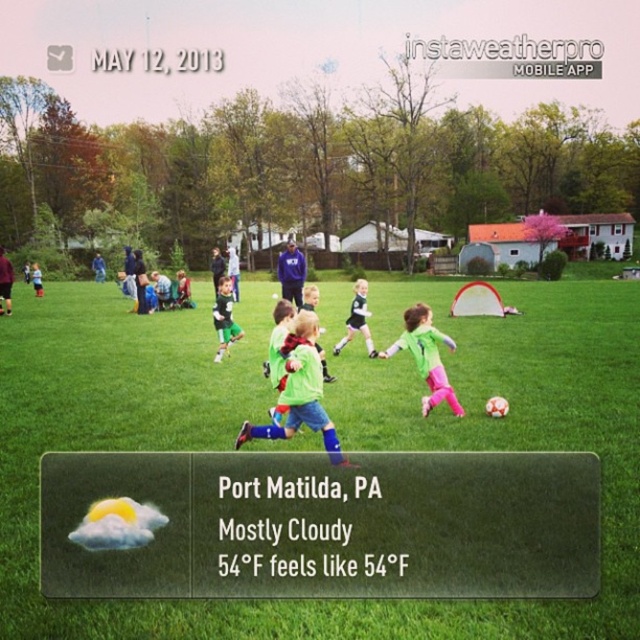
Question: Can you confirm if green matte soccer jersey at center is smaller than light blue jersey at center?

Choices:
 (A) no
 (B) yes

Answer: (B)

Question: Can you confirm if green matte soccer jersey at center is smaller than light blue jersey at center?

Choices:
 (A) no
 (B) yes

Answer: (B)

Question: Estimate the real-world distances between objects in this image. Which object is farther from the green jersey at center?

Choices:
 (A) green matte soccer jersey at center
 (B) green grass at center
 (C) green matte shirt at center
 (D) light blue jersey at center

Answer: (B)

Question: Can you confirm if green grass at center is smaller than green matte shirt at center?

Choices:
 (A) yes
 (B) no

Answer: (B)

Question: Which point appears farthest from the camera in this image?

Choices:
 (A) (356, 291)
 (B) (305, 390)
 (C) (428, 384)
 (D) (12, 605)

Answer: (A)

Question: Estimate the real-world distances between objects in this image. Which object is farther from the green matte shirt at center?

Choices:
 (A) green grass at center
 (B) green matte soccer jersey at center

Answer: (A)